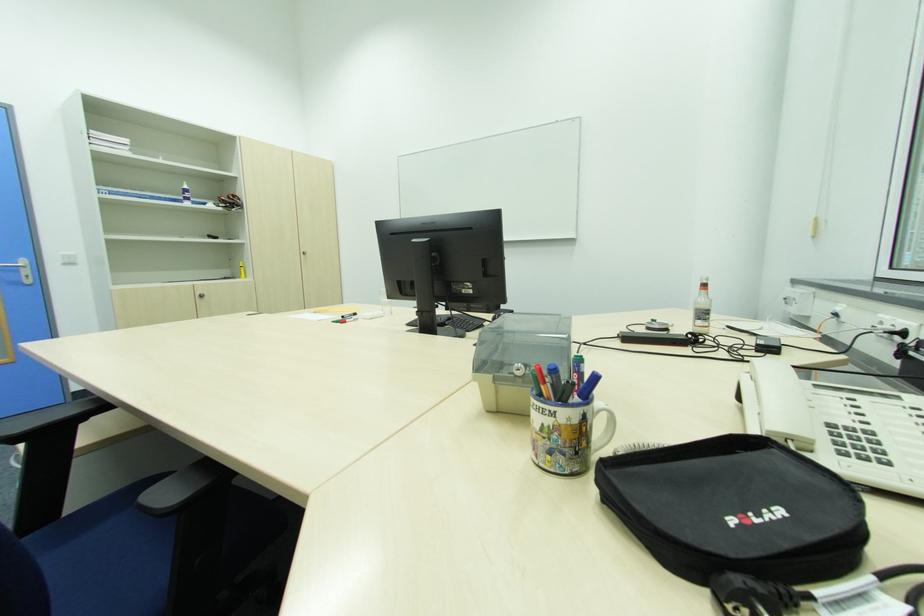
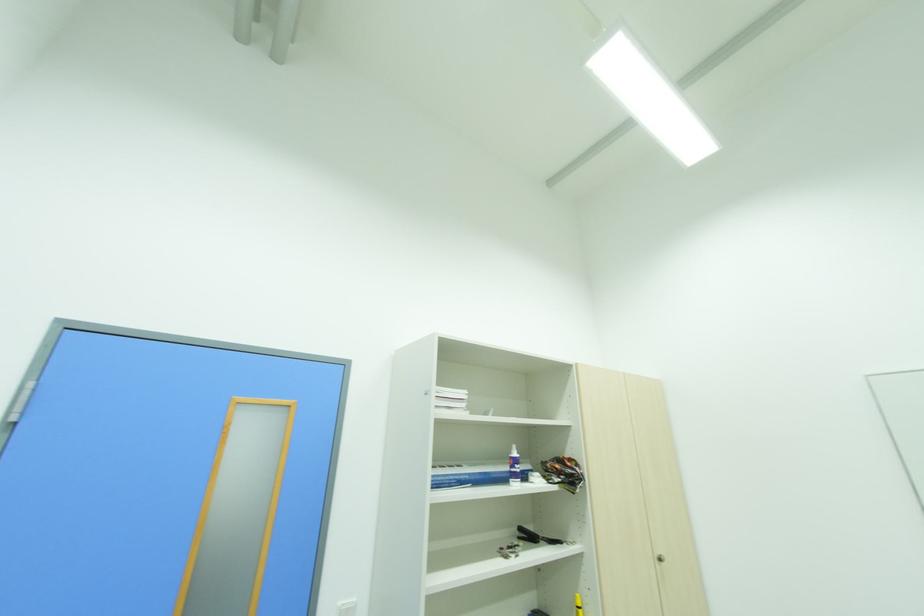
In the second image, find the point that corresponds to point 188,188 in the first image.

(517, 455)